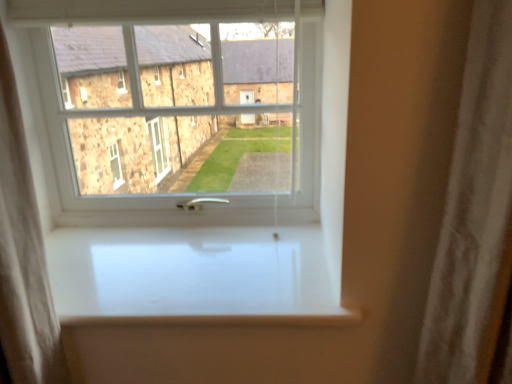
Describe the element at coordinates (182, 108) in the screenshot. I see `white plastic window at center` at that location.

Find the location of a particular element. white plastic window at center is located at coordinates (182, 108).

Locate an element on the screen. This screenshot has height=384, width=512. white glossy window sill at center is located at coordinates (193, 276).

What do you see at coordinates (193, 276) in the screenshot? I see `white glossy window sill at center` at bounding box center [193, 276].

Find the location of `white plastic window at center`. white plastic window at center is located at coordinates (182, 108).

Would you say white plastic window at center is to the left or to the right of white glossy window sill at center in the picture?

Clearly, white plastic window at center is on the left of white glossy window sill at center in the image.

In the image, is white plastic window at center positioned in front of or behind white glossy window sill at center?

In the image, white plastic window at center appears behind white glossy window sill at center.

Which is behind, point (106, 82) or point (317, 286)?

The point (106, 82) is farther from the camera.

From the image's perspective, is white plastic window at center below white glossy window sill at center?

No, from the image's perspective, white plastic window at center is not beneath white glossy window sill at center.

From a real-world perspective, between white plastic window at center and white glossy window sill at center, who is vertically higher?

From a 3D spatial view, white plastic window at center is above.

Can you confirm if white plastic window at center is thinner than white glossy window sill at center?

Yes.

Which of these two, white plastic window at center or white glossy window sill at center, stands taller?

With more height is white plastic window at center.

Can you confirm if white plastic window at center is smaller than white glossy window sill at center?

No.

Is white plastic window at center inside the boundaries of white glossy window sill at center, or outside?

white plastic window at center is not inside white glossy window sill at center, it's outside.

Are white plastic window at center and white glossy window sill at center beside each other?

white plastic window at center and white glossy window sill at center are not in contact.

Is white glossy window sill at center at the back of white plastic window at center?

white plastic window at center does not have its back to white glossy window sill at center.

In order to click on window sill beneath the white plastic window at center (from a real-world perspective) in this screenshot , I will do `click(193, 276)`.

Looking at this image, does white glossy window sill at center appear on the left side of white plastic window at center?

Incorrect, white glossy window sill at center is not on the left side of white plastic window at center.

Is the position of white glossy window sill at center more distant than that of white plastic window at center?

No, the depth of white glossy window sill at center is less than that of white plastic window at center.

Which is farther, (274, 323) or (274, 109)?

The point (274, 109) is more distant.

From the image's perspective, is white glossy window sill at center located above or below white plastic window at center?

white glossy window sill at center is situated lower than white plastic window at center in the image.

Looking at this image, from a real-world perspective, does white glossy window sill at center sit lower than white plastic window at center?

Yes, from a real-world perspective, white glossy window sill at center is below white plastic window at center.

Does white glossy window sill at center have a greater width compared to white plastic window at center?

Indeed, white glossy window sill at center has a greater width compared to white plastic window at center.

Is white glossy window sill at center taller or shorter than white plastic window at center?

In the image, white glossy window sill at center appears to be shorter than white plastic window at center.

Is white glossy window sill at center smaller than white plastic window at center?

Indeed, white glossy window sill at center has a smaller size compared to white plastic window at center.

Would you say white plastic window at center is part of white glossy window sill at center's contents?

No.

Are white glossy window sill at center and white plastic window at center beside each other?

No.

Could you tell me if white glossy window sill at center is facing white plastic window at center?

No, white glossy window sill at center is not turned towards white plastic window at center.

At what (x,y) coordinates should I click in order to perform the action: click on window sill located underneath the white plastic window at center (from a real-world perspective). Please return your answer as a coordinate pair (x, y). This screenshot has height=384, width=512. Looking at the image, I should click on (193, 276).

Image resolution: width=512 pixels, height=384 pixels. Find the location of `window sill located on the right of white plastic window at center`. window sill located on the right of white plastic window at center is located at coordinates (193, 276).

At what (x,y) coordinates should I click in order to perform the action: click on bay window that appears above the white glossy window sill at center (from the image's perspective). Please return your answer as a coordinate pair (x, y). Looking at the image, I should click on (182, 108).